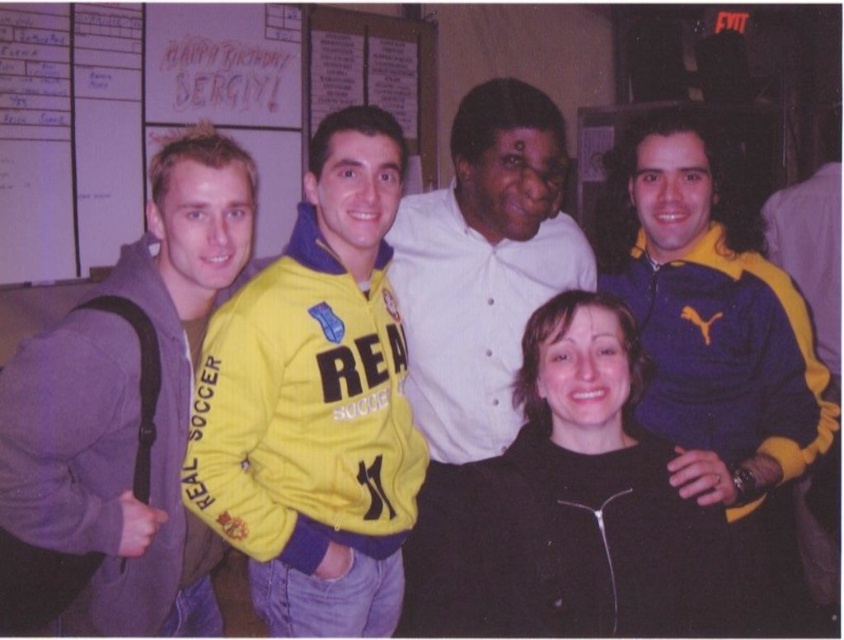
Question: Which of the following is the closest to the observer?

Choices:
 (A) (694, 304)
 (B) (552, 410)
 (C) (118, 488)

Answer: (B)

Question: Does black matte jacket at center appear on the left side of white shirt at center?

Choices:
 (A) no
 (B) yes

Answer: (A)

Question: Does blue/yellow track jacket at right have a larger size compared to black matte jacket at center?

Choices:
 (A) yes
 (B) no

Answer: (A)

Question: Which object appears closest to the camera in this image?

Choices:
 (A) blue/yellow track jacket at right
 (B) yellow fleece jacket at center
 (C) black matte jacket at center

Answer: (C)

Question: Among these objects, which one is nearest to the camera?

Choices:
 (A) black matte jacket at center
 (B) white shirt at center
 (C) blue/yellow track jacket at right
 (D) gray fleece jacket at left

Answer: (A)

Question: Can you confirm if yellow fleece jacket at center is thinner than gray fleece jacket at left?

Choices:
 (A) yes
 (B) no

Answer: (B)